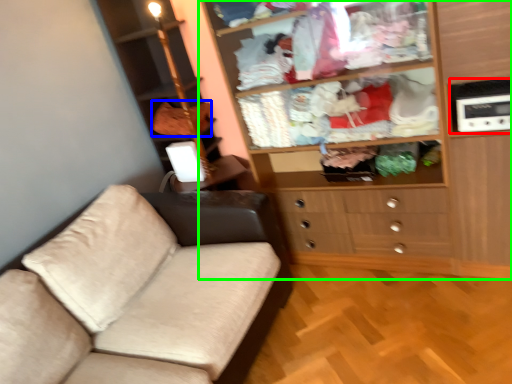
Question: Which is farther away from appliance (highlighted by a red box)? clothing (highlighted by a blue box) or cupboard (highlighted by a green box)?

Choices:
 (A) clothing
 (B) cupboard

Answer: (A)